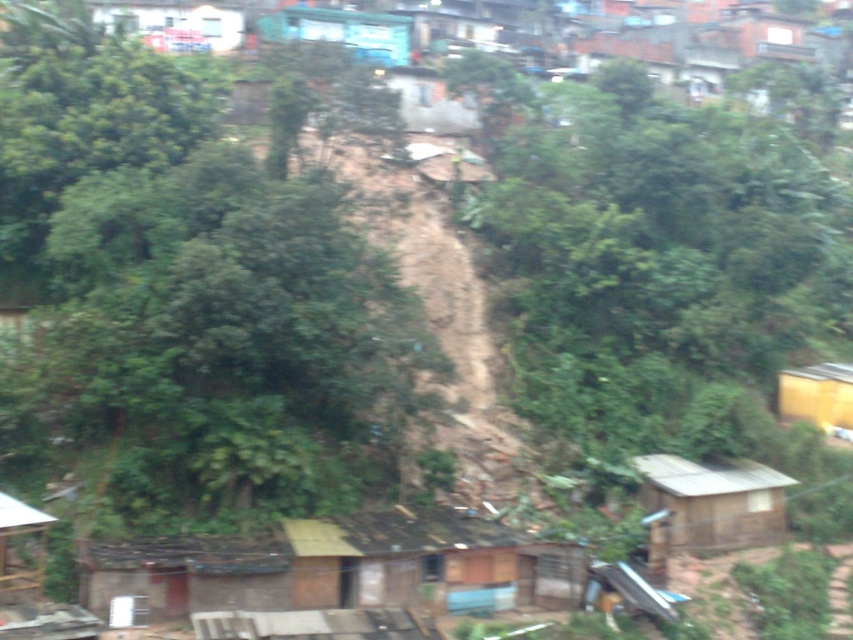
Question: Which object is farther from the camera taking this photo?

Choices:
 (A) yellow matte hut at right
 (B) green leafy tree at center
 (C) blue corrugated metal hut at upper center

Answer: (C)

Question: Is brown corrugated metal hut at lower center wider than yellow matte hut at right?

Choices:
 (A) yes
 (B) no

Answer: (A)

Question: Among these points, which one is nearest to the camera?

Choices:
 (A) (142, 557)
 (B) (763, 477)
 (C) (337, 12)

Answer: (A)

Question: Can you confirm if brown corrugated metal hut at lower center is smaller than blue corrugated metal hut at upper center?

Choices:
 (A) no
 (B) yes

Answer: (B)

Question: Among these objects, which one is farthest from the camera?

Choices:
 (A) green leafy tree at center
 (B) brown corrugated metal hut at lower center
 (C) wooden hut at lower left

Answer: (A)

Question: Is green leafy tree at center wider than brown wooden hut at lower right?

Choices:
 (A) no
 (B) yes

Answer: (B)